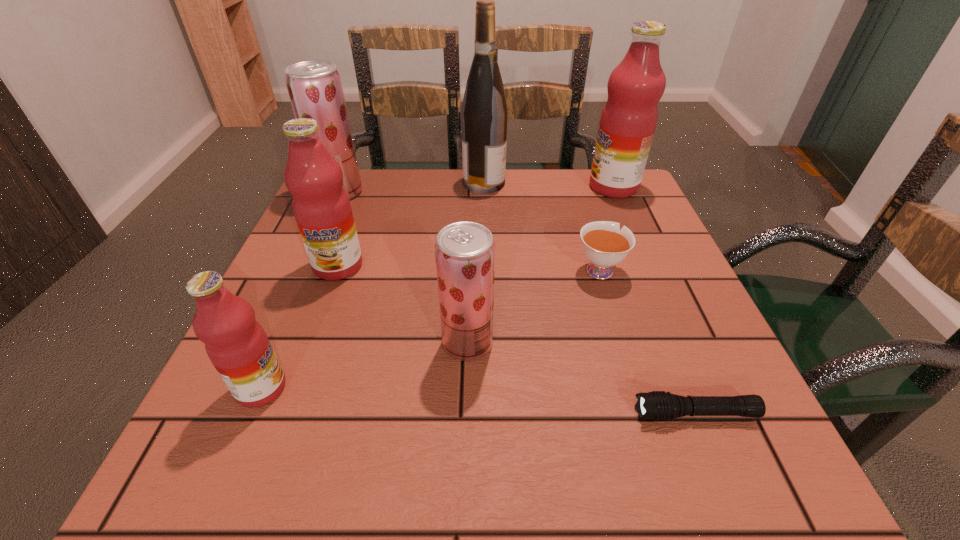
The width and height of the screenshot is (960, 540). Identify the location of free space located on the front of the nearer strawberry fruit juice. (467, 390).

Where is `vacant space located 0.140m on the label of the nearest pink fruit juice`? The width and height of the screenshot is (960, 540). vacant space located 0.140m on the label of the nearest pink fruit juice is located at coordinates (376, 388).

I want to click on vacant area located 0.200m on the side of the second shortest object with the handle, so click(x=578, y=200).

At what (x,y) coordinates should I click in order to perform the action: click on blank area located 0.070m on the side of the second shortest object with the handle. Please return your answer as a coordinate pair (x, y). Looking at the image, I should click on (588, 231).

This screenshot has height=540, width=960. I want to click on vacant area located 0.050m on the side of the second shortest object with the handle, so click(589, 237).

Image resolution: width=960 pixels, height=540 pixels. I want to click on vacant area situated at the lens end of the shortest object, so click(555, 414).

Locate an element on the screen. This screenshot has height=540, width=960. free space located 0.310m at the lens end of the shortest object is located at coordinates (426, 414).

You are a GUI agent. You are given a task and a screenshot of the screen. Output one action in this format:
    pyautogui.click(x=<x>, y=<y>)
    Task: Click on the vacant point located 0.310m at the lens end of the shortest object
    The image size is (960, 540).
    Given the screenshot: What is the action you would take?
    pyautogui.click(x=426, y=414)

Find the location of a particular element. The image size is (960, 540). wine bottle located at the far edge is located at coordinates (484, 113).

Where is `object that is positioned at the near edge`? The height and width of the screenshot is (540, 960). object that is positioned at the near edge is located at coordinates (657, 405).